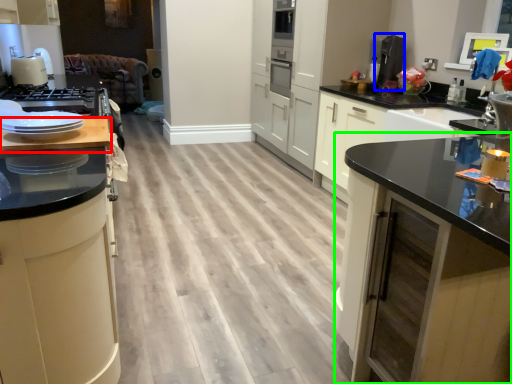
Question: Which is farther away from countertop (highlighted by a red box)? coffee machine (highlighted by a blue box) or cabinetry (highlighted by a green box)?

Choices:
 (A) coffee machine
 (B) cabinetry

Answer: (A)